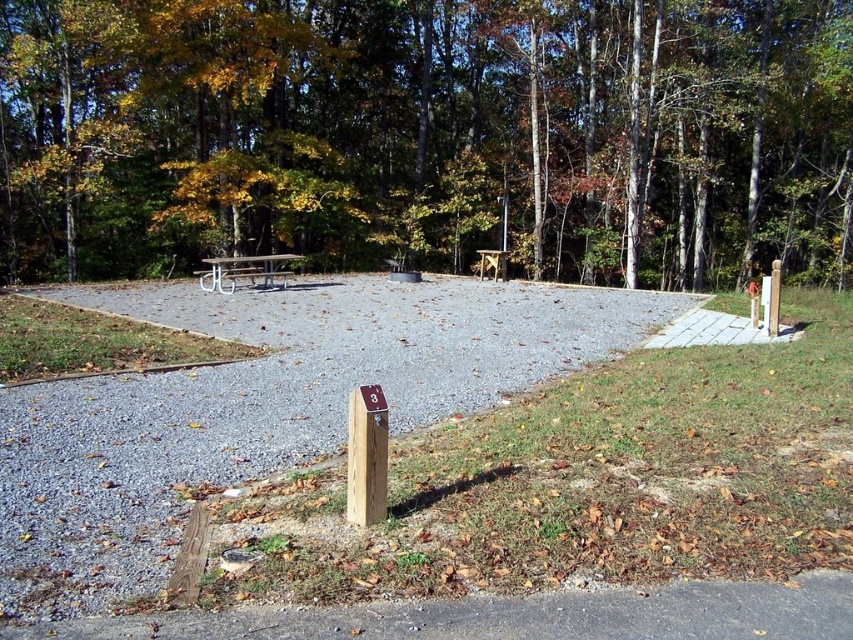
You are a hiker who wants to set up a tent. You have two options for the location. One is on the gray gravel at center, and the other is on the gray asphalt at lower center. Which surface would be better for setting up your tent, considering the ground type and elevation?

The gray gravel at center is located above gray asphalt at lower center, so setting up the tent on the gray gravel at center would be better as it is elevated and less likely to flood during rain.

You are planning to set up a tent in the campground and need to choose between placing it on the gray gravel at center or the white concrete path at right. Considering the size of the materials, which surface would provide a more stable base for the tent stakes?

The gray gravel at center is larger in size than the white concrete path at right. Larger gravel might be less stable for tent stakes as they can shift more easily compared to smaller, more compact materials. Therefore, the white concrete path at right would provide a more stable base for the tent stakes.